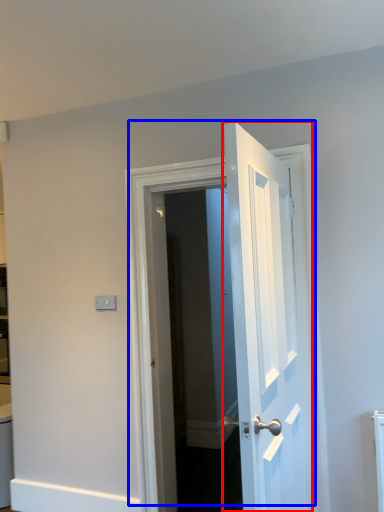
Question: Which of the following is the closest to the observer, door (highlighted by a red box) or door (highlighted by a blue box)?

Choices:
 (A) door
 (B) door

Answer: (A)